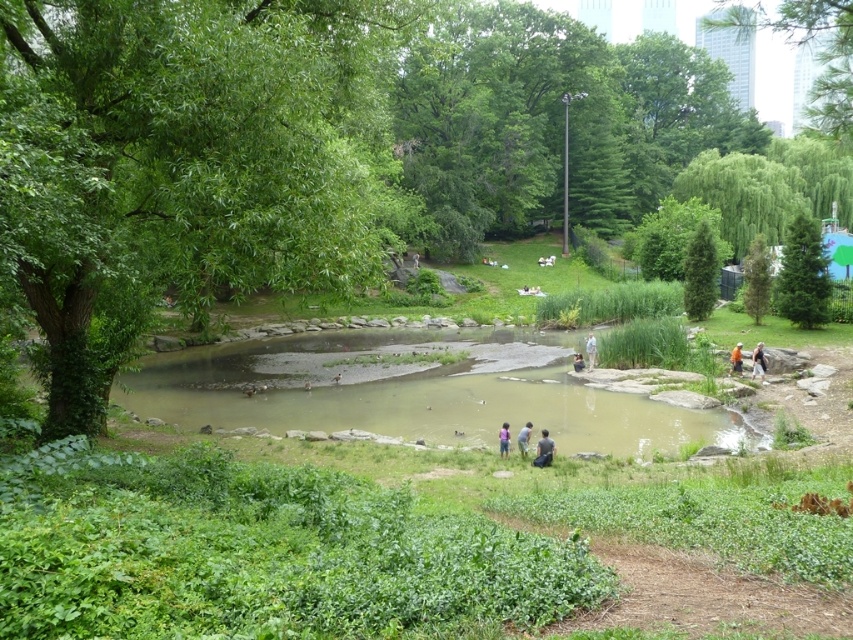
You are standing in the park and see a point marked at coordinates (694, 282). If you want to walk towards this point, how far will you have to walk?

The point at coordinates (694, 282) is 44.05 meters away from you, so you will have to walk 44.05 meters to reach it.

You are standing in the park and see the green leafy tree at left and the light brown leather jacket at center. Which object is located to the left of the other?

The green leafy tree at left is positioned on the left side of light brown leather jacket at center.